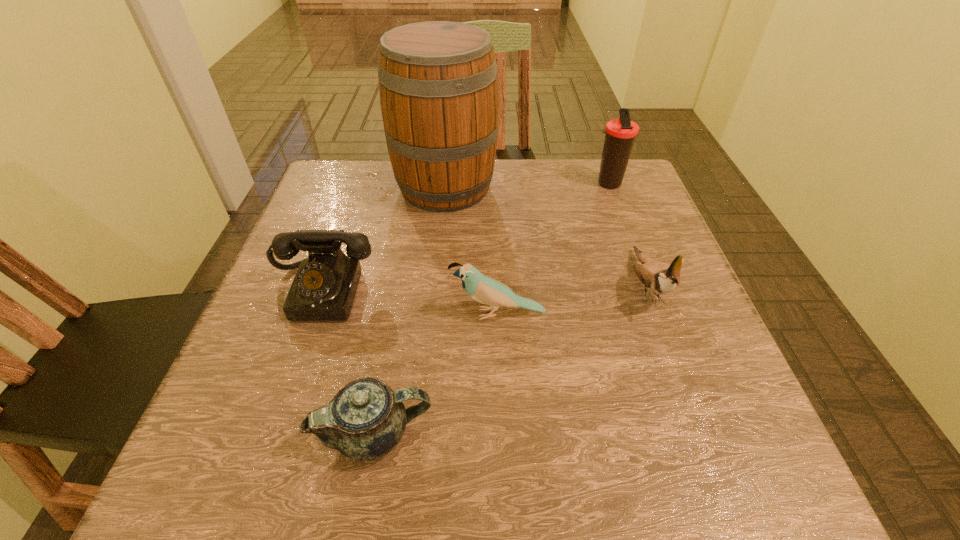
What are the coordinates of `the tallest object` in the screenshot? It's located at (438, 84).

This screenshot has width=960, height=540. What are the coordinates of `the fifth shortest object` in the screenshot? It's located at (620, 133).

I want to click on the right bird, so click(x=659, y=277).

This screenshot has height=540, width=960. Identify the location of the left bird. (484, 289).

Where is `telephone`? This screenshot has width=960, height=540. telephone is located at coordinates (324, 288).

This screenshot has width=960, height=540. I want to click on the nearest object, so click(366, 419).

I want to click on chinaware, so click(366, 419).

Where is `free location located on the front of the tallest object`? The image size is (960, 540). free location located on the front of the tallest object is located at coordinates (437, 268).

You are a GUI agent. You are given a task and a screenshot of the screen. Output one action in this format:
    pyautogui.click(x=<x>, y=<y>)
    Task: Click on the blank area located on the front of the thermos bottle
    
    Given the screenshot: What is the action you would take?
    pyautogui.click(x=624, y=228)

I want to click on blank area located at the face of the right bird, so click(x=720, y=486).